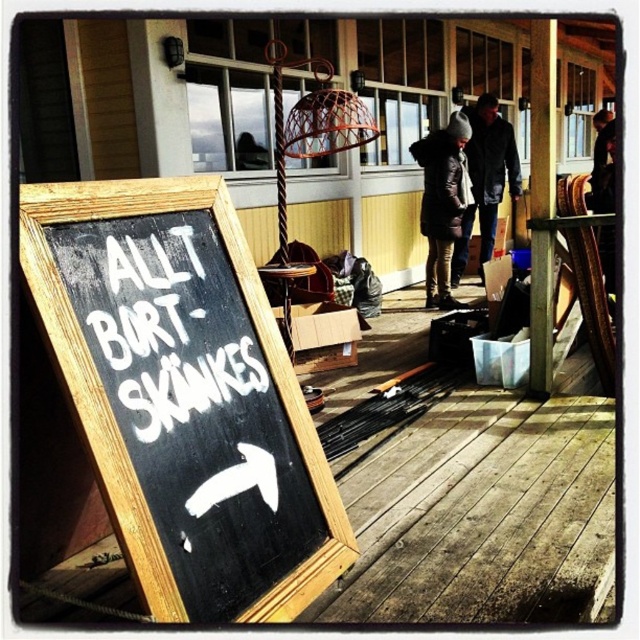
You are organizing a community event and need to place a 1.2 meter wide banner between the white chalkboard sign at left and the dark gray woolen hat at center. Can the banner fit between them based on their widths?

The white chalkboard sign at left has a lesser width compared to dark gray woolen hat at center. Since the banner is 1.2 meters wide, but we don not have exact measurements for the objects, it is impossible to determine if the banner can fit between them based solely on their widths.

You are organizing a charity event and need to place a donation box next to the white chalkboard sign at left. However, there is a dark brown fur coat at center in the way. Can you move the fur coat to make space?

The white chalkboard sign at left is smaller than the dark brown fur coat at center, so moving the fur coat would allow more space for the donation box next to the sign.

Looking at this image, you are standing on the wooden deck and want to read the white chalkboard sign at left. Where should you look to find it?

The white chalkboard sign at left is located at the 2D coordinates point (x=173, y=328), so you should look towards the left side of the deck to find it.